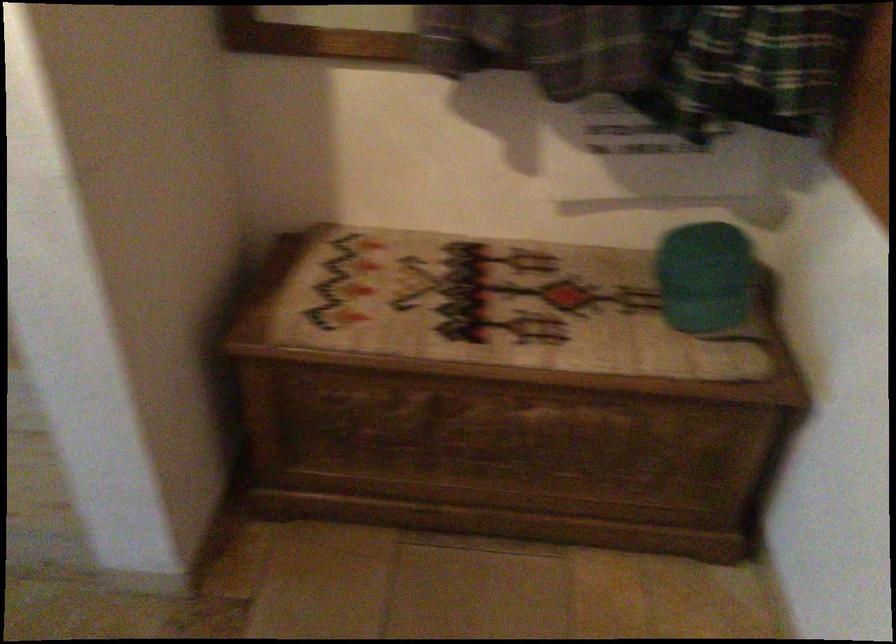
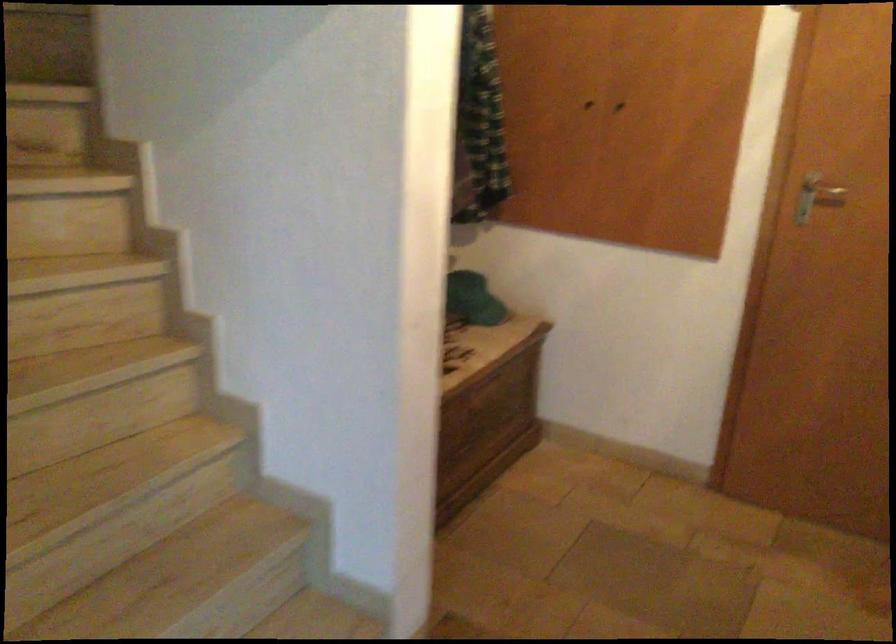
The point at (684, 272) is marked in the first image. Where is the corresponding point in the second image?

(472, 299)